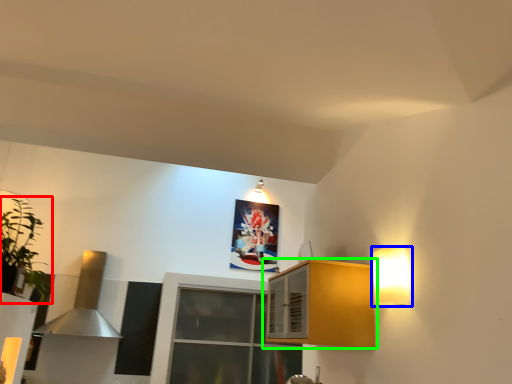
Question: Based on their relative distances, which object is farther from houseplant (highlighted by a red box)? Choose from light fixture (highlighted by a blue box) and cabinetry (highlighted by a green box).

Choices:
 (A) light fixture
 (B) cabinetry

Answer: (A)